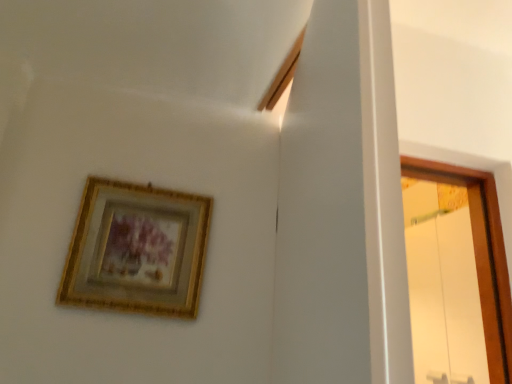
Looking at this image, what is the approximate height of gold/gilded picture frame at upper left?

The height of gold/gilded picture frame at upper left is 11.88 inches.

What do you see at coordinates (137, 250) in the screenshot? I see `gold/gilded picture frame at upper left` at bounding box center [137, 250].

Identify the location of gold/gilded picture frame at upper left. (137, 250).

Measure the distance between gold/gilded picture frame at upper left and camera.

The depth of gold/gilded picture frame at upper left is 35.14 inches.

Find the location of a particular element. gold/gilded picture frame at upper left is located at coordinates (137, 250).